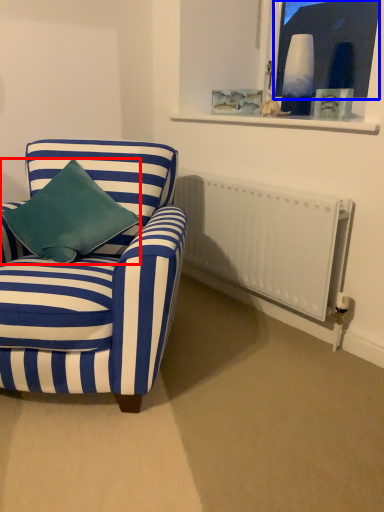
Question: Among these objects, which one is nearest to the camera, pillow (highlighted by a red box) or window screen (highlighted by a blue box)?

Choices:
 (A) pillow
 (B) window screen

Answer: (A)